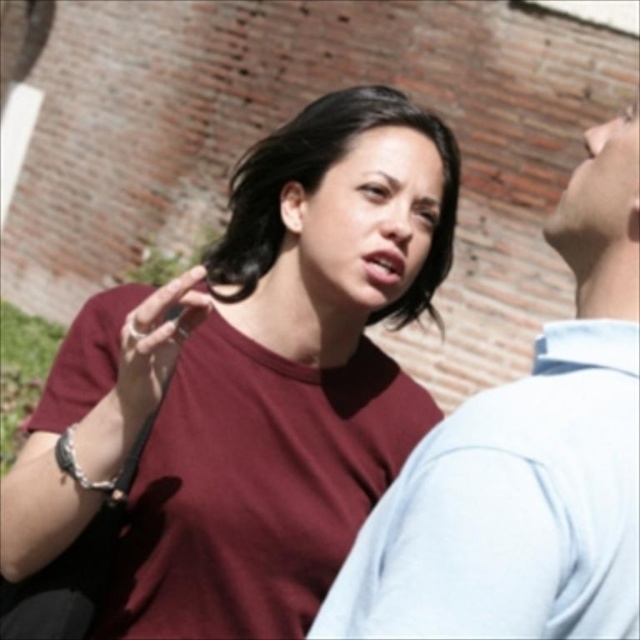
You are a photographer adjusting your camera to focus on two points in the scene. The first point is point (109, 305) and the second is point (164, 324). Which point should you focus on first if you want to ensure both are in focus?

You should focus on point (109, 305) first because it is closer to the camera than point (164, 324). By focusing on the closer point, the depth of field may extend to include the farther point as well.